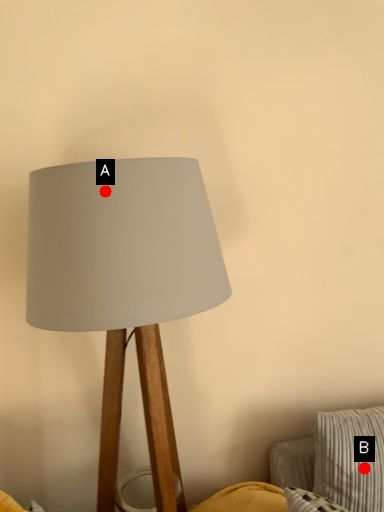
Question: Two points are circled on the image, labeled by A and B beside each circle. Which point appears farthest from the camera in this image?

Choices:
 (A) A is further
 (B) B is further

Answer: (B)